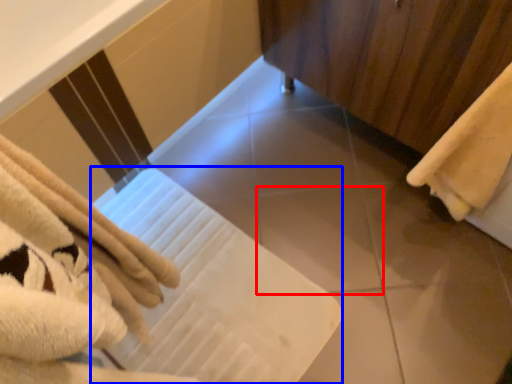
Question: Which object is closer to the camera taking this photo, tile (highlighted by a red box) or bath towel (highlighted by a blue box)?

Choices:
 (A) tile
 (B) bath towel

Answer: (B)